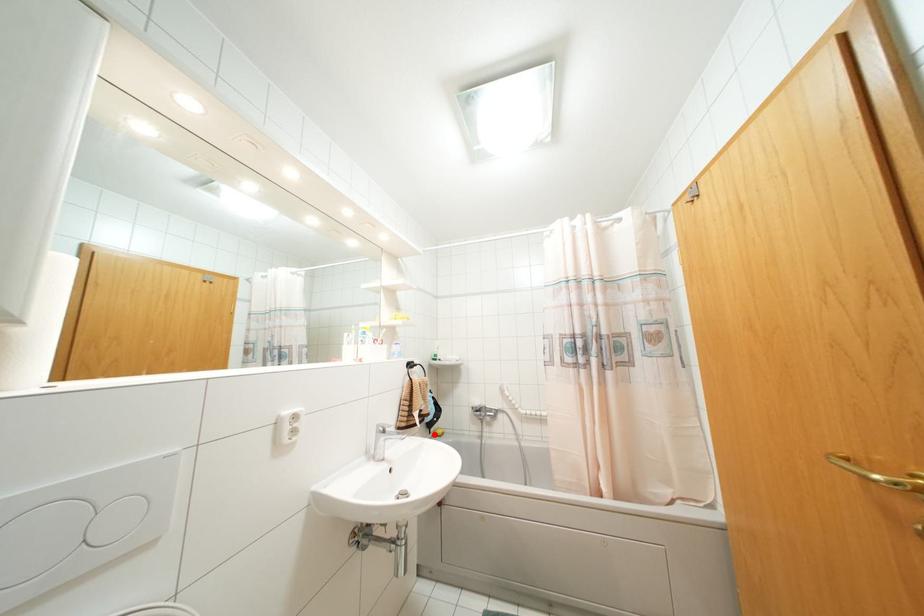
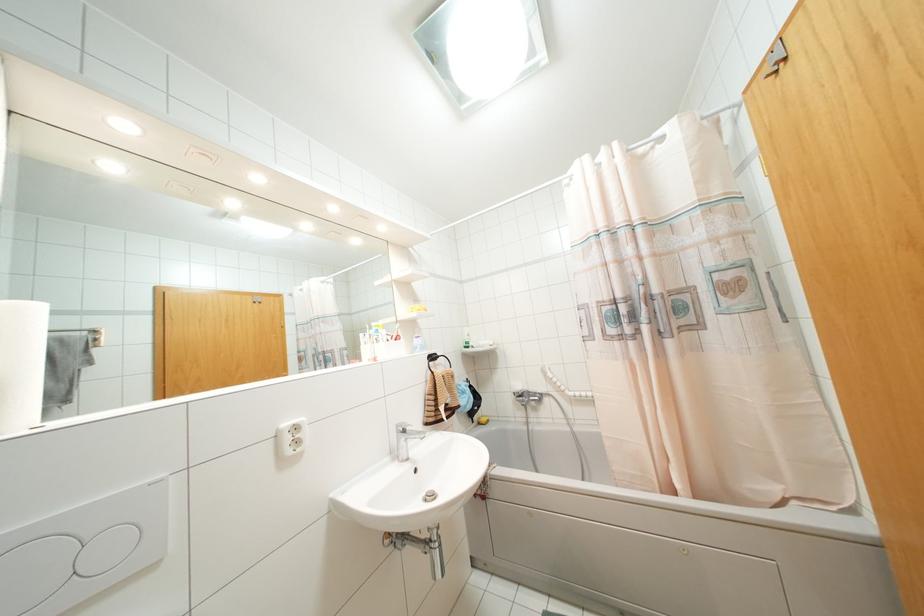
Find the pixel in the second image that matches the highlighted location in the first image.

(479, 423)